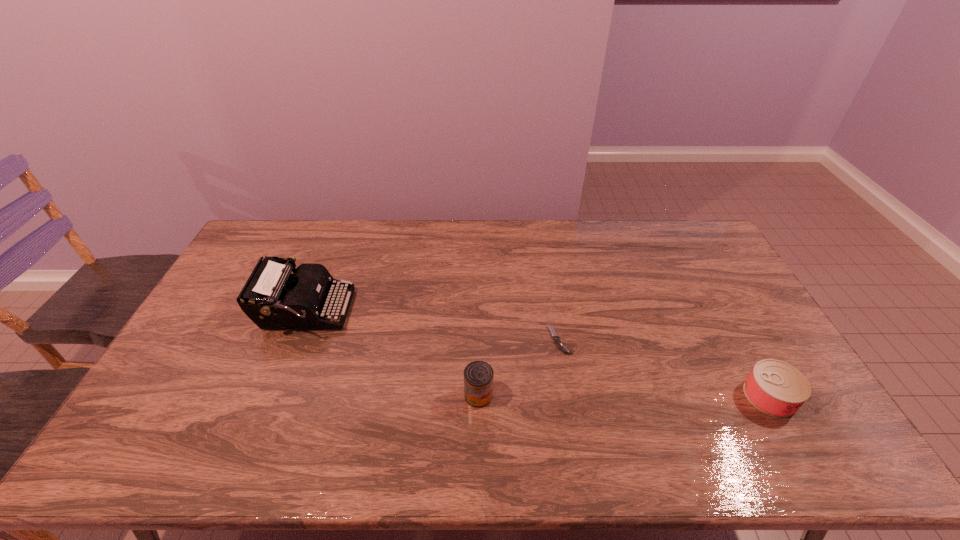
Locate an element on the screen. free spot located 0.070m on the back of the rightmost object is located at coordinates (747, 355).

Find the location of a particular element. This screenshot has width=960, height=540. vacant space located 0.300m on the left of the third object from left to right is located at coordinates (448, 340).

Where is `object positioned at the right edge`? object positioned at the right edge is located at coordinates (776, 388).

You are a GUI agent. You are given a task and a screenshot of the screen. Output one action in this format:
    pyautogui.click(x=<x>, y=<y>)
    Task: Click on the vacant space at the far edge of the desktop
    The height and width of the screenshot is (540, 960).
    Given the screenshot: What is the action you would take?
    pyautogui.click(x=509, y=248)

Identify the location of vacant space at the near edge of the desktop. Image resolution: width=960 pixels, height=540 pixels. (728, 458).

Find the location of `vacant area at the left edge of the desktop`. vacant area at the left edge of the desktop is located at coordinates (212, 335).

Where is `vacant region at the right edge of the desktop`? This screenshot has width=960, height=540. vacant region at the right edge of the desktop is located at coordinates (712, 297).

Find the location of `free space between the second object from left to right and the shorter can`. free space between the second object from left to right and the shorter can is located at coordinates (x=624, y=396).

The width and height of the screenshot is (960, 540). I want to click on unoccupied position between the second tallest object and the rightmost object, so click(x=624, y=396).

I want to click on vacant space that is in between the rightmost object and the tallest object, so click(x=538, y=353).